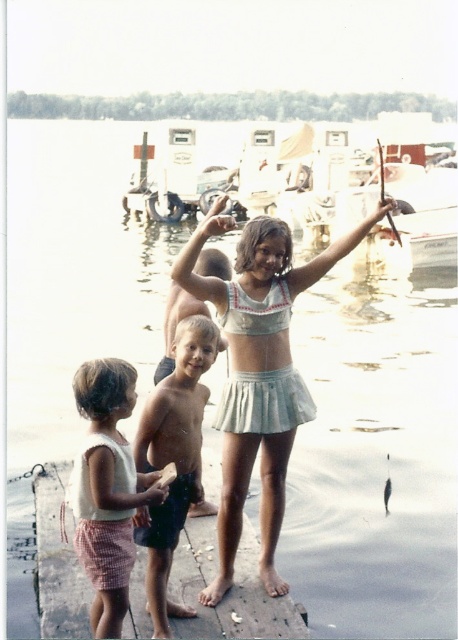
You are a photographer trying to capture a group photo of the children on the dock. Given the wooden dock at center and the white cotton tank top at lower left, which object occupies more horizontal space in the image?

The wooden dock at center occupies more horizontal space in the image because its width is larger than that of the white cotton tank top at lower left.